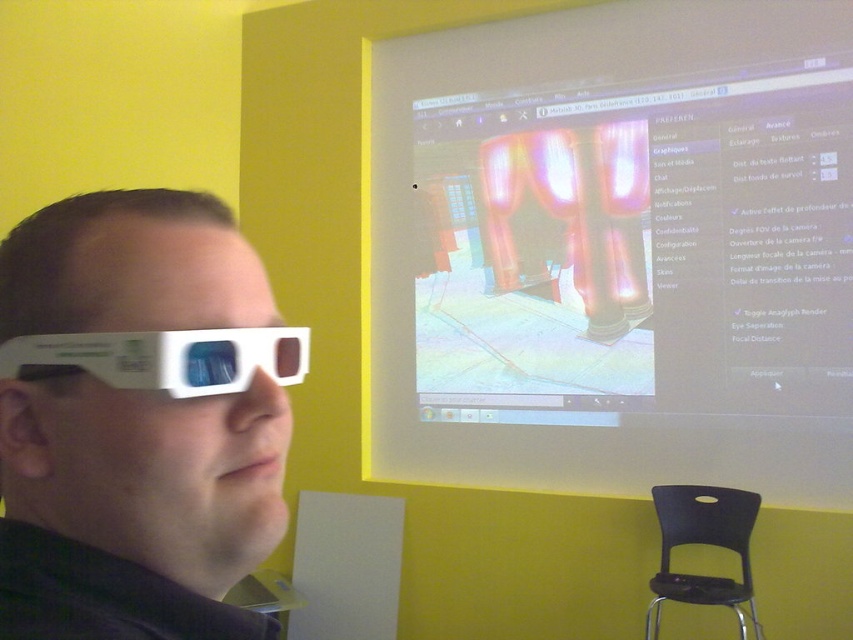
Question: Which object is closer to the camera taking this photo?

Choices:
 (A) transparent plastic screen at upper center
 (B) black plastic chair at lower right
 (C) white plastic glasses at left

Answer: (C)

Question: Is transparent plastic screen at upper center to the right of white plastic 3d glasses at left from the viewer's perspective?

Choices:
 (A) yes
 (B) no

Answer: (A)

Question: Estimate the real-world distances between objects in this image. Which object is closer to the white plastic 3d glasses at left?

Choices:
 (A) transparent plastic screen at upper center
 (B) black plastic chair at lower right
 (C) white plastic glasses at left

Answer: (C)

Question: Does white plastic glasses at left lie in front of black plastic chair at lower right?

Choices:
 (A) no
 (B) yes

Answer: (B)

Question: Which object appears closest to the camera in this image?

Choices:
 (A) white plastic glasses at left
 (B) black plastic chair at lower right

Answer: (A)

Question: In this image, where is transparent plastic screen at upper center located relative to black plastic chair at lower right?

Choices:
 (A) below
 (B) above

Answer: (B)